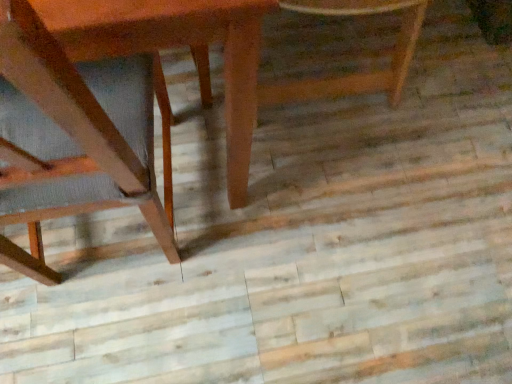
Question: From a real-world perspective, is wooden table at left physically below wooden chair at left, which is the first chair from left to right?

Choices:
 (A) yes
 (B) no

Answer: (A)

Question: From a real-world perspective, is wooden table at left positioned over wooden chair at left, placed as the second chair when sorted from right to left, based on gravity?

Choices:
 (A) no
 (B) yes

Answer: (A)

Question: Is wooden chair at left, placed as the second chair when sorted from right to left, surrounded by wooden table at left?

Choices:
 (A) yes
 (B) no

Answer: (A)

Question: Could you tell me if wooden table at left is facing wooden chair at left, placed as the second chair when sorted from right to left?

Choices:
 (A) yes
 (B) no

Answer: (A)

Question: Is wooden table at left at the left side of wooden chair at left, which is the first chair from left to right?

Choices:
 (A) yes
 (B) no

Answer: (A)

Question: Considering the positions of point (329, 1) and point (38, 193), is point (329, 1) closer or farther from the camera than point (38, 193)?

Choices:
 (A) closer
 (B) farther

Answer: (B)

Question: Is wooden chair at center, the 2th chair positioned from the left, bigger or smaller than wooden chair at left, placed as the second chair when sorted from right to left?

Choices:
 (A) small
 (B) big

Answer: (A)

Question: Would you say wooden chair at center, the 2th chair positioned from the left, is inside or outside wooden chair at left, placed as the second chair when sorted from right to left?

Choices:
 (A) outside
 (B) inside

Answer: (A)

Question: Considering their positions, is wooden chair at center, the 1th chair when ordered from right to left, located in front of or behind wooden chair at left, placed as the second chair when sorted from right to left?

Choices:
 (A) front
 (B) behind

Answer: (B)

Question: Is wooden table at left taller or shorter than wooden chair at left, which is the first chair from left to right?

Choices:
 (A) short
 (B) tall

Answer: (A)

Question: Considering the positions of point (164, 14) and point (137, 196), is point (164, 14) closer or farther from the camera than point (137, 196)?

Choices:
 (A) closer
 (B) farther

Answer: (A)

Question: From a real-world perspective, is wooden table at left above or below wooden chair at left, placed as the second chair when sorted from right to left?

Choices:
 (A) above
 (B) below

Answer: (B)

Question: Would you say wooden table at left is to the left or to the right of wooden chair at left, which is the first chair from left to right, in the picture?

Choices:
 (A) right
 (B) left

Answer: (B)

Question: Visually, is wooden chair at left, placed as the second chair when sorted from right to left, positioned to the left or to the right of wooden table at left?

Choices:
 (A) right
 (B) left

Answer: (A)

Question: Is wooden chair at left, which is the first chair from left to right, bigger or smaller than wooden table at left?

Choices:
 (A) small
 (B) big

Answer: (A)